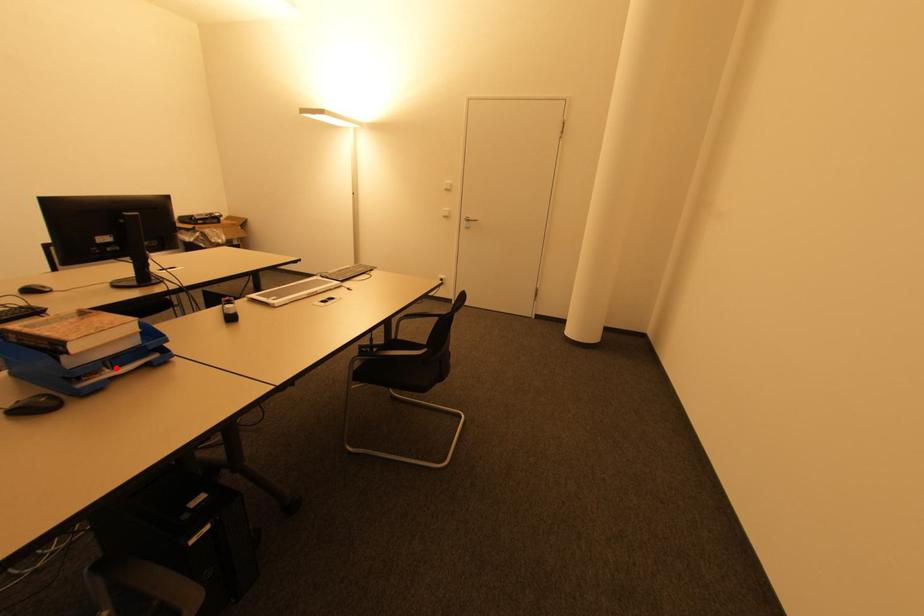
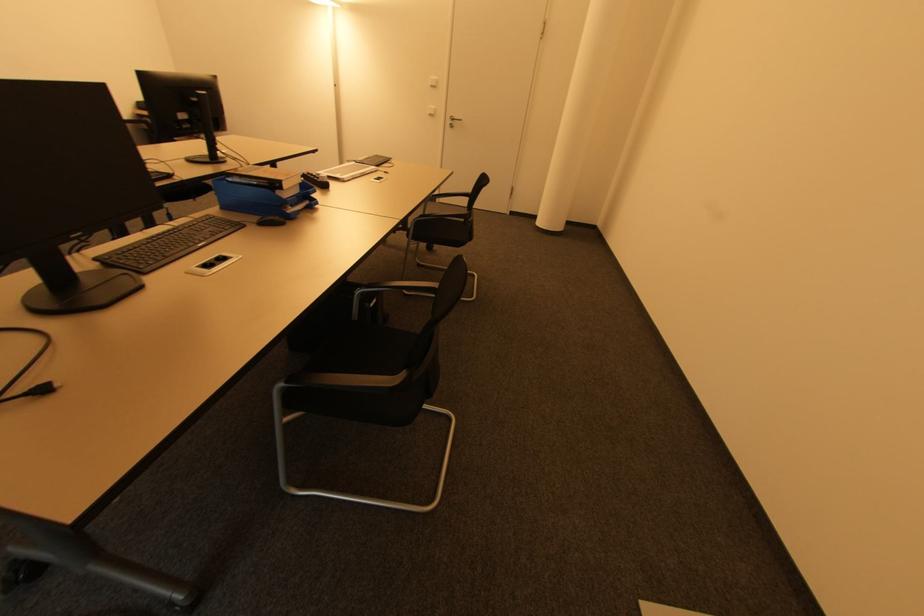
Locate, in the second image, the point that corresponds to the highlighted location in the first image.

(294, 207)